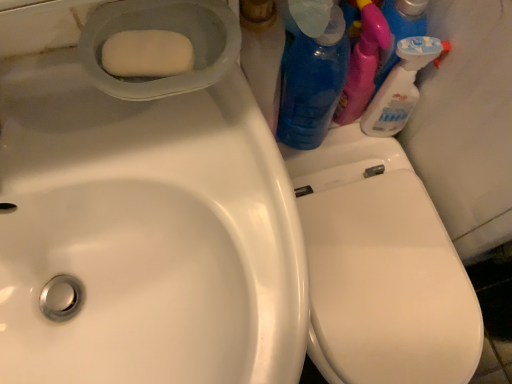
Measure the distance between blue translucent bottle at upper right, acting as the second cleaning product starting from the right, and camera.

The distance of blue translucent bottle at upper right, acting as the second cleaning product starting from the right, from camera is 18.54 inches.

Image resolution: width=512 pixels, height=384 pixels. What do you see at coordinates (312, 85) in the screenshot?
I see `blue translucent bottle at upper right, acting as the second cleaning product starting from the right` at bounding box center [312, 85].

Where is `white glossy sink at upper left`? The width and height of the screenshot is (512, 384). white glossy sink at upper left is located at coordinates (147, 215).

Which point is more distant from viewer, (172, 371) or (410, 96)?

The point (410, 96) is farther.

Can you tell me how much white glossy sink at upper left and white glossy spray bottle at upper right, acting as the second cleaning product starting from the left, differ in facing direction?

They differ by 0.674 degrees in their facing directions.

Is white glossy sink at upper left positioned with its back to white glossy spray bottle at upper right, which is counted as the 1th cleaning product, starting from the right?

No, white glossy sink at upper left is not facing away from white glossy spray bottle at upper right, which is counted as the 1th cleaning product, starting from the right.

Can white glossy spray bottle at upper right, acting as the second cleaning product starting from the left, be found inside white glossy sink at upper left?

No, white glossy spray bottle at upper right, acting as the second cleaning product starting from the left, is located outside of white glossy sink at upper left.

Which point is more forward, (79, 63) or (324, 120)?

The point (79, 63) is closer to the camera.

Between white glossy sink at upper left and blue translucent bottle at upper right, marked as the 1th cleaning product in a left-to-right arrangement, which one has larger size?

With larger size is white glossy sink at upper left.

Measure the distance between white glossy sink at upper left and blue translucent bottle at upper right, acting as the second cleaning product starting from the right.

white glossy sink at upper left and blue translucent bottle at upper right, acting as the second cleaning product starting from the right, are 12.71 inches apart from each other.

From a real-world perspective, is white glossy sink at upper left under blue translucent bottle at upper right, marked as the 1th cleaning product in a left-to-right arrangement?

Incorrect, from a real-world perspective, white glossy sink at upper left is higher than blue translucent bottle at upper right, marked as the 1th cleaning product in a left-to-right arrangement.

Which is farther from the camera, (301, 67) or (377, 118)?

The point (377, 118) is more distant.

Does blue translucent bottle at upper right, marked as the 1th cleaning product in a left-to-right arrangement, have a greater height compared to white glossy spray bottle at upper right, which is counted as the 1th cleaning product, starting from the right?

Correct, blue translucent bottle at upper right, marked as the 1th cleaning product in a left-to-right arrangement, is much taller as white glossy spray bottle at upper right, which is counted as the 1th cleaning product, starting from the right.

From the picture: Is blue translucent bottle at upper right, marked as the 1th cleaning product in a left-to-right arrangement, facing towards white glossy spray bottle at upper right, which is counted as the 1th cleaning product, starting from the right?

No, blue translucent bottle at upper right, marked as the 1th cleaning product in a left-to-right arrangement, is not turned towards white glossy spray bottle at upper right, which is counted as the 1th cleaning product, starting from the right.

Which object is thinner, blue translucent bottle at upper right, acting as the second cleaning product starting from the right, or white glossy spray bottle at upper right, which is counted as the 1th cleaning product, starting from the right?

white glossy spray bottle at upper right, which is counted as the 1th cleaning product, starting from the right, is thinner.

Considering the relative positions of white glossy spray bottle at upper right, which is counted as the 1th cleaning product, starting from the right, and white glossy sink at upper left in the image provided, is white glossy spray bottle at upper right, which is counted as the 1th cleaning product, starting from the right, to the right of white glossy sink at upper left from the viewer's perspective?

Correct, you'll find white glossy spray bottle at upper right, which is counted as the 1th cleaning product, starting from the right, to the right of white glossy sink at upper left.

Locate an element on the screen. This screenshot has width=512, height=384. sink on the left of white glossy spray bottle at upper right, which is counted as the 1th cleaning product, starting from the right is located at coordinates (147, 215).

From the image's perspective, is white glossy spray bottle at upper right, which is counted as the 1th cleaning product, starting from the right, beneath white glossy sink at upper left?

No.

Which of these two, white glossy spray bottle at upper right, which is counted as the 1th cleaning product, starting from the right, or white glossy sink at upper left, is bigger?

white glossy sink at upper left is bigger.

Is white matte soap at upper left not inside blue translucent bottle at upper right, acting as the second cleaning product starting from the right?

Yes, white matte soap at upper left is not within blue translucent bottle at upper right, acting as the second cleaning product starting from the right.

Is white matte soap at upper left further to camera compared to blue translucent bottle at upper right, acting as the second cleaning product starting from the right?

That is False.

From the image's perspective, is white matte soap at upper left above or below blue translucent bottle at upper right, marked as the 1th cleaning product in a left-to-right arrangement?

white matte soap at upper left is below blue translucent bottle at upper right, marked as the 1th cleaning product in a left-to-right arrangement.

Could you tell me if white matte soap at upper left is turned towards blue translucent bottle at upper right, marked as the 1th cleaning product in a left-to-right arrangement?

No, white matte soap at upper left is not aimed at blue translucent bottle at upper right, marked as the 1th cleaning product in a left-to-right arrangement.

You are a GUI agent. You are given a task and a screenshot of the screen. Output one action in this format:
    pyautogui.click(x=<x>, y=<y>)
    Task: Click on the cleaning product on the left of white glossy spray bottle at upper right, which is counted as the 1th cleaning product, starting from the right
    The image size is (512, 384).
    Given the screenshot: What is the action you would take?
    pos(312,85)

Is white glossy spray bottle at upper right, which is counted as the 1th cleaning product, starting from the right, surrounding blue translucent bottle at upper right, acting as the second cleaning product starting from the right?

No.

Based on the photo, from a real-world perspective, which object stands above the other?

blue translucent bottle at upper right, acting as the second cleaning product starting from the right.

Is white glossy spray bottle at upper right, which is counted as the 1th cleaning product, starting from the right, closer to camera compared to blue translucent bottle at upper right, acting as the second cleaning product starting from the right?

No, the depth of white glossy spray bottle at upper right, which is counted as the 1th cleaning product, starting from the right, is greater than that of blue translucent bottle at upper right, acting as the second cleaning product starting from the right.

Considering the relative sizes of blue translucent bottle at upper right, acting as the second cleaning product starting from the right, and white glossy sink at upper left in the image provided, is blue translucent bottle at upper right, acting as the second cleaning product starting from the right, wider than white glossy sink at upper left?

No, blue translucent bottle at upper right, acting as the second cleaning product starting from the right, is not wider than white glossy sink at upper left.

From the image's perspective, does blue translucent bottle at upper right, marked as the 1th cleaning product in a left-to-right arrangement, appear lower than white glossy sink at upper left?

No, from the image's perspective, blue translucent bottle at upper right, marked as the 1th cleaning product in a left-to-right arrangement, is not below white glossy sink at upper left.

Is point (334, 43) less distant than point (57, 367)?

No, (334, 43) is further to viewer.

Considering the relative positions of blue translucent bottle at upper right, acting as the second cleaning product starting from the right, and white glossy sink at upper left in the image provided, is blue translucent bottle at upper right, acting as the second cleaning product starting from the right, to the right of white glossy sink at upper left from the viewer's perspective?

Indeed, blue translucent bottle at upper right, acting as the second cleaning product starting from the right, is positioned on the right side of white glossy sink at upper left.

In order to click on sink in front of the white glossy spray bottle at upper right, which is counted as the 1th cleaning product, starting from the right in this screenshot , I will do `click(147, 215)`.

The width and height of the screenshot is (512, 384). In order to click on cleaning product that is the 1st object to the right of the white glossy sink at upper left, starting at the anchor in this screenshot , I will do `click(312, 85)`.

Which object lies nearer to the anchor point white glossy sink at upper left, white glossy spray bottle at upper right, acting as the second cleaning product starting from the left, or blue translucent bottle at upper right, acting as the second cleaning product starting from the right?

The object closer to white glossy sink at upper left is blue translucent bottle at upper right, acting as the second cleaning product starting from the right.

Looking at the image, which one is located further to blue translucent bottle at upper right, marked as the 1th cleaning product in a left-to-right arrangement, white glossy sink at upper left or white matte soap at upper left?

white matte soap at upper left is further to blue translucent bottle at upper right, marked as the 1th cleaning product in a left-to-right arrangement.

When comparing their distances from blue translucent bottle at upper right, marked as the 1th cleaning product in a left-to-right arrangement, does white glossy spray bottle at upper right, acting as the second cleaning product starting from the left, or white matte soap at upper left seem closer?

Based on the image, white glossy spray bottle at upper right, acting as the second cleaning product starting from the left, appears to be nearer to blue translucent bottle at upper right, marked as the 1th cleaning product in a left-to-right arrangement.

Estimate the real-world distances between objects in this image. Which object is further from white matte soap at upper left, white glossy sink at upper left or white glossy spray bottle at upper right, acting as the second cleaning product starting from the left?

Based on the image, white glossy spray bottle at upper right, acting as the second cleaning product starting from the left, appears to be further to white matte soap at upper left.

From the image, which object appears to be farther from white glossy spray bottle at upper right, which is counted as the 1th cleaning product, starting from the right, white glossy sink at upper left or white matte soap at upper left?

Based on the image, white glossy sink at upper left appears to be further to white glossy spray bottle at upper right, which is counted as the 1th cleaning product, starting from the right.

Considering their positions, is white glossy spray bottle at upper right, which is counted as the 1th cleaning product, starting from the right, positioned further to blue translucent bottle at upper right, acting as the second cleaning product starting from the right, than white glossy sink at upper left?

white glossy sink at upper left is further to blue translucent bottle at upper right, acting as the second cleaning product starting from the right.

When comparing their distances from white glossy sink at upper left, does white glossy spray bottle at upper right, acting as the second cleaning product starting from the left, or white matte soap at upper left seem further?

white glossy spray bottle at upper right, acting as the second cleaning product starting from the left, lies further to white glossy sink at upper left than the other object.

Estimate the real-world distances between objects in this image. Which object is closer to white glossy sink at upper left, blue translucent bottle at upper right, marked as the 1th cleaning product in a left-to-right arrangement, or white glossy spray bottle at upper right, which is counted as the 1th cleaning product, starting from the right?

blue translucent bottle at upper right, marked as the 1th cleaning product in a left-to-right arrangement, lies closer to white glossy sink at upper left than the other object.

I want to click on cleaning product between white glossy sink at upper left and white glossy spray bottle at upper right, which is counted as the 1th cleaning product, starting from the right, so click(x=312, y=85).

In order to click on soap between white glossy sink at upper left and white glossy spray bottle at upper right, which is counted as the 1th cleaning product, starting from the right, in the horizontal direction in this screenshot , I will do `click(147, 54)`.

Identify the location of cleaning product located between white matte soap at upper left and white glossy spray bottle at upper right, which is counted as the 1th cleaning product, starting from the right, in the left-right direction. (312, 85).

Identify the location of soap positioned between white glossy sink at upper left and blue translucent bottle at upper right, marked as the 1th cleaning product in a left-to-right arrangement, from near to far. (x=147, y=54).